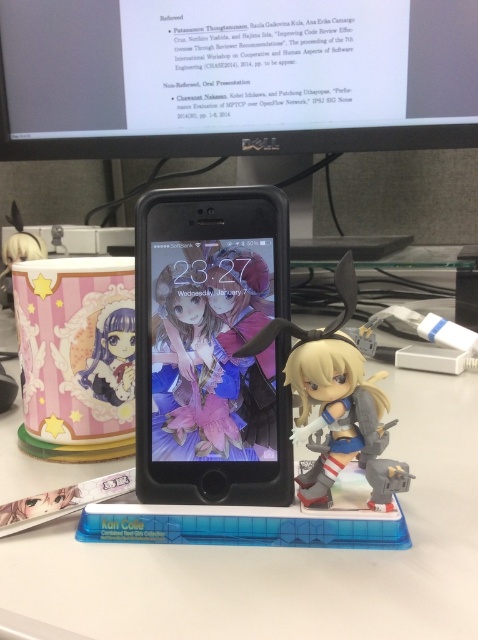
You are organizing your desk and want to place the black matte phone at center and the matte plastic figurine at left into a drawer. The drawer has a height limit of 15 cm. Which item might not fit if the phone is 18 cm tall?

The black matte phone at center is much taller than the matte plastic figurine at left. Since the phone is 18 cm tall and the drawer has a 15 cm height limit, the black matte phone at center might not fit.

You are organizing your desk and want to move the black matte phone at center closer to the black matte computer monitor at upper center. However, you notice that the phone is currently positioned in a way that might block access to the monitor. Based on their current positions, can you move the phone to the front without moving the monitor?

The black matte phone at center is behind the black matte computer monitor at upper center. To move the phone to the front, you would need to physically move the monitor first, as the phone is currently positioned behind it and cannot be accessed without doing so.